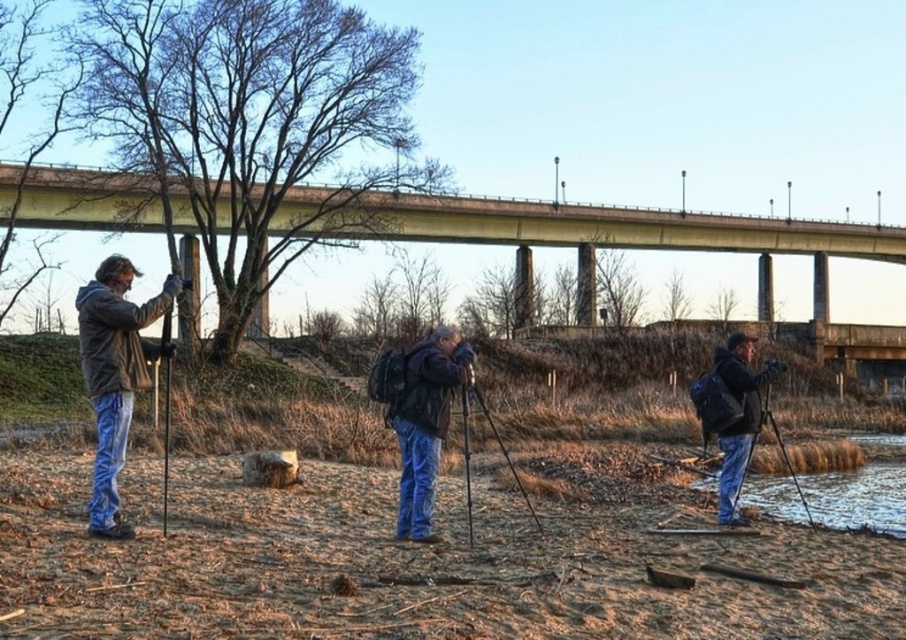
Question: Which point is closer to the camera?

Choices:
 (A) brown muddy water at lower right
 (B) black matte tripod at center
 (C) leather jacket at center

Answer: (B)

Question: Which point is farther to the camera?

Choices:
 (A) black matte tripod at center
 (B) concrete bridge at upper center
 (C) leather jacket at center
 (D) dark blue jacket at right

Answer: (B)

Question: Among these objects, which one is nearest to the camera?

Choices:
 (A) dark blue jacket at right
 (B) leather jacket at center
 (C) black matte tripod at center

Answer: (C)

Question: Does brown muddy water at lower right have a smaller size compared to dark blue jacket at right?

Choices:
 (A) no
 (B) yes

Answer: (A)

Question: Does dark blue jacket at right have a lesser width compared to black matte tripod at center?

Choices:
 (A) yes
 (B) no

Answer: (B)

Question: Is matte black jacket at left smaller than dark blue jacket at right?

Choices:
 (A) yes
 (B) no

Answer: (A)